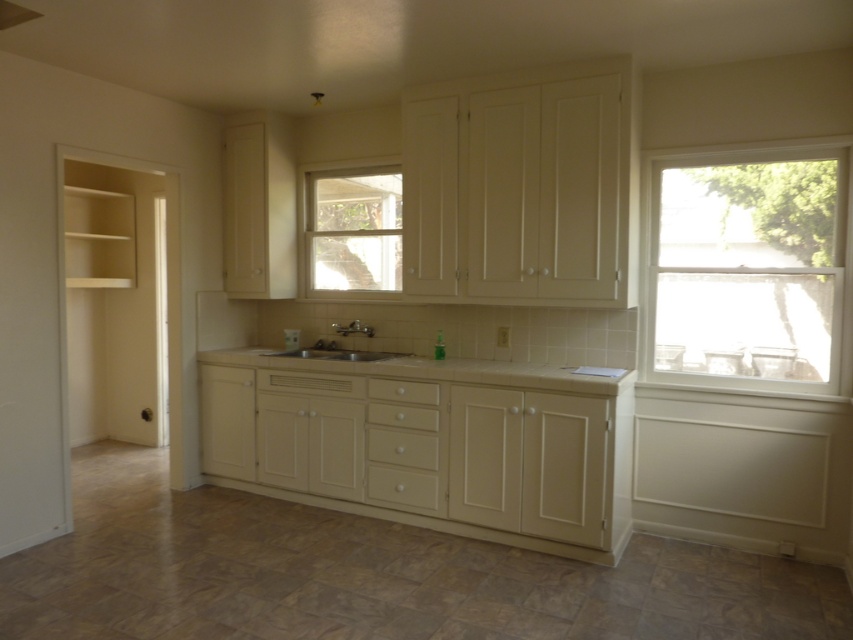
Question: Which of the following is the closest to the observer?

Choices:
 (A) white glossy sink at center
 (B) white laminate countertop at center

Answer: (B)

Question: Which point is farther from the camera taking this photo?

Choices:
 (A) (305, 349)
 (B) (363, 360)

Answer: (A)

Question: Observing the image, what is the correct spatial positioning of clear glass window at center in reference to beige tile countertop at center?

Choices:
 (A) above
 (B) below

Answer: (A)

Question: Which of these objects is positioned closest to the white laminate countertop at center?

Choices:
 (A) clear glass window at center
 (B) clear glass window at right
 (C) beige tile countertop at center

Answer: (C)

Question: Is clear glass window at center positioned behind white glossy sink at center?

Choices:
 (A) yes
 (B) no

Answer: (A)

Question: Does white laminate countertop at center have a smaller size compared to white glossy sink at center?

Choices:
 (A) yes
 (B) no

Answer: (B)